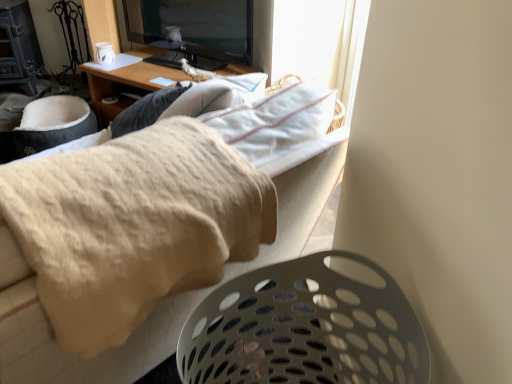
Where is `white perforated laundry basket at lower right`? This screenshot has width=512, height=384. white perforated laundry basket at lower right is located at coordinates (305, 329).

Describe the element at coordinates (124, 84) in the screenshot. I see `wooden desk at upper center` at that location.

Locate an element on the screen. white perforated laundry basket at lower right is located at coordinates (305, 329).

Which object is further away from the camera taking this photo, beige fabric couch at upper center or white perforated laundry basket at lower right?

white perforated laundry basket at lower right is further from the camera.

Is beige fabric couch at upper center spatially inside white perforated laundry basket at lower right, or outside of it?

beige fabric couch at upper center cannot be found inside white perforated laundry basket at lower right.

How different are the orientations of beige fabric couch at upper center and white perforated laundry basket at lower right in degrees?

3.85 degrees.

Considering the relative sizes of beige fabric couch at upper center and white perforated laundry basket at lower right in the image provided, is beige fabric couch at upper center bigger than white perforated laundry basket at lower right?

Correct, beige fabric couch at upper center is larger in size than white perforated laundry basket at lower right.

Consider the image. Can you tell me how much beige fabric couch at upper center and wooden desk at upper center differ in facing direction?

The angle between the facing direction of beige fabric couch at upper center and the facing direction of wooden desk at upper center is 91.7 degrees.

Where is `furniture below the wooden desk at upper center (from the image's perspective)`? Image resolution: width=512 pixels, height=384 pixels. furniture below the wooden desk at upper center (from the image's perspective) is located at coordinates point(68,353).

From a real-world perspective, which is physically below, beige fabric couch at upper center or wooden desk at upper center?

wooden desk at upper center.

Would you say white perforated laundry basket at lower right is outside beige fabric couch at upper center?

Yes, white perforated laundry basket at lower right is not within beige fabric couch at upper center.

Is the surface of white perforated laundry basket at lower right in direct contact with beige fabric couch at upper center?

white perforated laundry basket at lower right and beige fabric couch at upper center are not in contact.

In the image, is white perforated laundry basket at lower right on the left side or the right side of beige fabric couch at upper center?

From the image, it's evident that white perforated laundry basket at lower right is to the right of beige fabric couch at upper center.

Is wooden desk at upper center oriented towards beige fabric couch at upper center?

No, wooden desk at upper center does not turn towards beige fabric couch at upper center.

Considering the relative sizes of wooden desk at upper center and beige fabric couch at upper center in the image provided, is wooden desk at upper center smaller than beige fabric couch at upper center?

Actually, wooden desk at upper center might be larger than beige fabric couch at upper center.

How far apart are wooden desk at upper center and beige fabric couch at upper center?

wooden desk at upper center and beige fabric couch at upper center are 4.73 feet apart.

In terms of height, does wooden desk at upper center look taller or shorter compared to beige fabric couch at upper center?

wooden desk at upper center is shorter than beige fabric couch at upper center.

From a real-world perspective, is white perforated laundry basket at lower right positioned over wooden desk at upper center based on gravity?

Yes, from a real-world perspective, white perforated laundry basket at lower right is over wooden desk at upper center

Can you confirm if white perforated laundry basket at lower right is positioned to the left of wooden desk at upper center?

In fact, white perforated laundry basket at lower right is to the right of wooden desk at upper center.

From the picture: Considering the relative sizes of white perforated laundry basket at lower right and wooden desk at upper center in the image provided, is white perforated laundry basket at lower right smaller than wooden desk at upper center?

Yes.

This screenshot has width=512, height=384. I want to click on desk behind the white perforated laundry basket at lower right, so click(x=124, y=84).

From a real-world perspective, relative to white perforated laundry basket at lower right, is wooden desk at upper center vertically above or below?

In terms of real-world spatial position, wooden desk at upper center is below white perforated laundry basket at lower right.

Could you tell me if wooden desk at upper center is turned towards white perforated laundry basket at lower right?

No, wooden desk at upper center is not facing towards white perforated laundry basket at lower right.

Is wooden desk at upper center next to white perforated laundry basket at lower right and touching it?

wooden desk at upper center and white perforated laundry basket at lower right are clearly separated.

Does wooden desk at upper center have a smaller size compared to white perforated laundry basket at lower right?

No, wooden desk at upper center is not smaller than white perforated laundry basket at lower right.

Locate an element on the screen. furniture lying above the white perforated laundry basket at lower right (from the image's perspective) is located at coordinates (68, 353).

Find the location of a particular element. furniture in front of the wooden desk at upper center is located at coordinates [68, 353].

Looking at the image, which one is located further to white perforated laundry basket at lower right, wooden desk at upper center or beige fabric couch at upper center?

wooden desk at upper center is further to white perforated laundry basket at lower right.

Estimate the real-world distances between objects in this image. Which object is closer to white perforated laundry basket at lower right, beige fabric couch at upper center or wooden desk at upper center?

beige fabric couch at upper center is positioned closer to the anchor white perforated laundry basket at lower right.

Considering their positions, is white perforated laundry basket at lower right positioned further to wooden desk at upper center than beige fabric couch at upper center?

Among the two, white perforated laundry basket at lower right is located further to wooden desk at upper center.

From the image, which object appears to be farther from beige fabric couch at upper center, white perforated laundry basket at lower right or wooden desk at upper center?

The object further to beige fabric couch at upper center is wooden desk at upper center.

Considering their positions, is beige fabric couch at upper center positioned closer to wooden desk at upper center than white perforated laundry basket at lower right?

beige fabric couch at upper center lies closer to wooden desk at upper center than the other object.

Based on their spatial positions, is wooden desk at upper center or white perforated laundry basket at lower right closer to beige fabric couch at upper center?

Among the two, white perforated laundry basket at lower right is located nearer to beige fabric couch at upper center.

Locate an element on the screen. The image size is (512, 384). laundry basket between beige fabric couch at upper center and wooden desk at upper center along the z-axis is located at coordinates (305, 329).